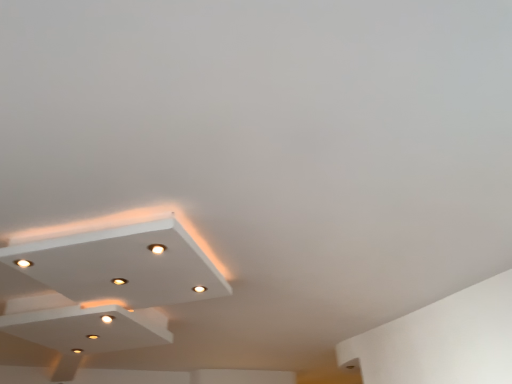
Question: Does matte white light at center have a lesser height compared to white matte exhaust hood at lower left?

Choices:
 (A) yes
 (B) no

Answer: (A)

Question: Considering the relative sizes of matte white light at center and white matte exhaust hood at lower left in the image provided, is matte white light at center taller than white matte exhaust hood at lower left?

Choices:
 (A) yes
 (B) no

Answer: (B)

Question: Can you see matte white light at center touching white matte exhaust hood at lower left?

Choices:
 (A) no
 (B) yes

Answer: (A)

Question: From the image's perspective, is matte white light at center located above white matte exhaust hood at lower left?

Choices:
 (A) no
 (B) yes

Answer: (B)

Question: From a real-world perspective, is matte white light at center located higher than white matte exhaust hood at lower left?

Choices:
 (A) yes
 (B) no

Answer: (A)

Question: From a real-world perspective, is matte white light at center below white matte exhaust hood at lower left?

Choices:
 (A) no
 (B) yes

Answer: (A)

Question: Does matte white droplight at center have a larger size compared to matte white light at center?

Choices:
 (A) yes
 (B) no

Answer: (B)

Question: From the image's perspective, is matte white droplight at center under matte white light at center?

Choices:
 (A) yes
 (B) no

Answer: (B)

Question: From a real-world perspective, is matte white droplight at center on top of matte white light at center?

Choices:
 (A) yes
 (B) no

Answer: (A)

Question: Is matte white droplight at center turned away from matte white light at center?

Choices:
 (A) yes
 (B) no

Answer: (A)

Question: Considering the relative sizes of matte white droplight at center and matte white light at center in the image provided, is matte white droplight at center shorter than matte white light at center?

Choices:
 (A) no
 (B) yes

Answer: (B)

Question: Is matte white droplight at center not within matte white light at center?

Choices:
 (A) no
 (B) yes

Answer: (B)

Question: Can you confirm if white matte exhaust hood at lower left is positioned to the right of matte white droplight at center?

Choices:
 (A) yes
 (B) no

Answer: (B)